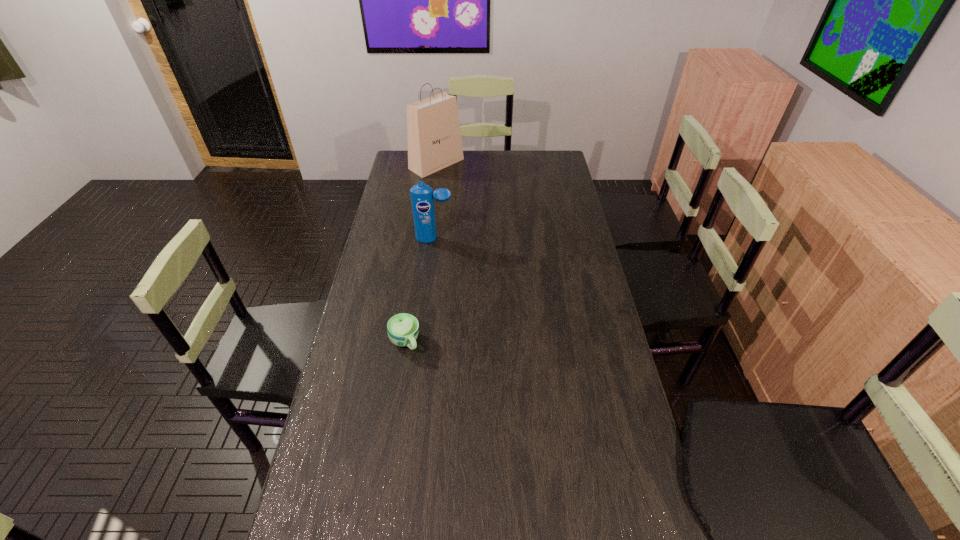
I want to click on shopping bag present at the left edge, so click(x=434, y=139).

You are a GUI agent. You are given a task and a screenshot of the screen. Output one action in this format:
    pyautogui.click(x=<x>, y=<y>)
    Task: Click on the shampoo that is at the left edge
    Image resolution: width=960 pixels, height=540 pixels.
    Given the screenshot: What is the action you would take?
    pyautogui.click(x=422, y=195)

I want to click on cup that is at the left edge, so click(402, 328).

Locate an element on the screen. The image size is (960, 540). object that is at the far left corner is located at coordinates (434, 139).

The width and height of the screenshot is (960, 540). What are the coordinates of `vacant space at the far edge` in the screenshot? It's located at [483, 155].

Where is `free space at the left edge of the desktop`? The image size is (960, 540). free space at the left edge of the desktop is located at coordinates (334, 392).

Where is `vacant space at the right edge of the desktop`? vacant space at the right edge of the desktop is located at coordinates (605, 384).

Identify the location of vacant space at the far right corner of the desktop. The image size is (960, 540). (564, 164).

Image resolution: width=960 pixels, height=540 pixels. In order to click on vacant point located between the second farthest object and the tallest object in this screenshot , I will do 436,201.

Where is `vacant area that lies between the nearest object and the shopping bag`? Image resolution: width=960 pixels, height=540 pixels. vacant area that lies between the nearest object and the shopping bag is located at coordinates (420, 253).